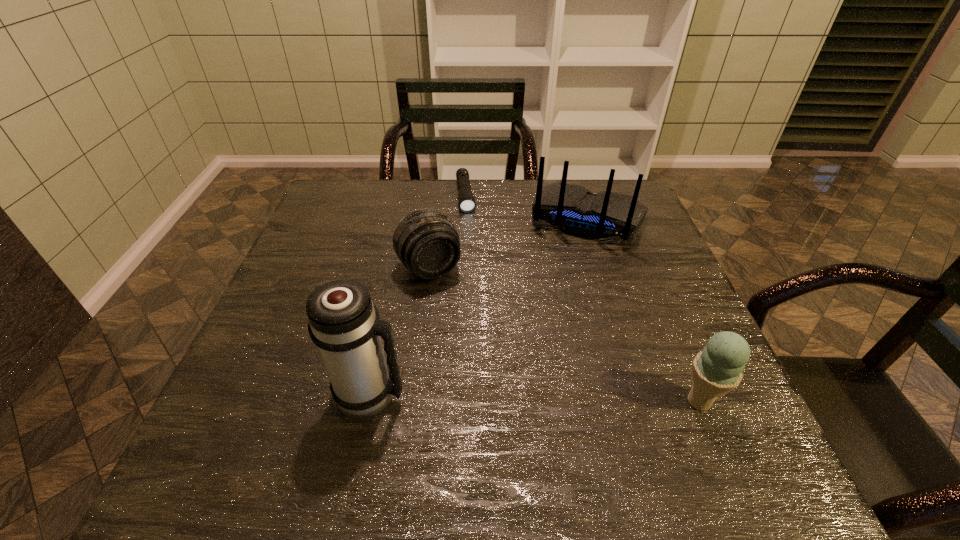
This screenshot has height=540, width=960. In order to click on thermos bottle in this screenshot , I will do tap(343, 322).

This screenshot has width=960, height=540. What are the coordinates of `the third tallest object` in the screenshot? It's located at (716, 370).

At what (x,y) coordinates should I click in order to perform the action: click on the second shortest object. Please return your answer as a coordinate pair (x, y). This screenshot has width=960, height=540. Looking at the image, I should click on (426, 242).

Find the location of `the second tallest object`. the second tallest object is located at coordinates (572, 209).

Locate an element on the screen. This screenshot has height=540, width=960. the shortest object is located at coordinates (466, 199).

Locate an element on the screen. The image size is (960, 540). vacant space located on the side with the handle of the thermos bottle is located at coordinates (485, 394).

You are a GUI agent. You are given a task and a screenshot of the screen. Output one action in this format:
    pyautogui.click(x=<x>, y=<y>)
    Task: Click on the vacant space located on the back of the ice cream
    
    Given the screenshot: What is the action you would take?
    pyautogui.click(x=667, y=326)

Where is `free space located at the front element of the fourth tallest object`? The width and height of the screenshot is (960, 540). free space located at the front element of the fourth tallest object is located at coordinates (462, 322).

The height and width of the screenshot is (540, 960). In order to click on free point located at the front element of the fourth tallest object in this screenshot , I will do `click(526, 428)`.

Where is `vacant area located 0.110m at the front element of the fourth tallest object`? vacant area located 0.110m at the front element of the fourth tallest object is located at coordinates coord(460,319).